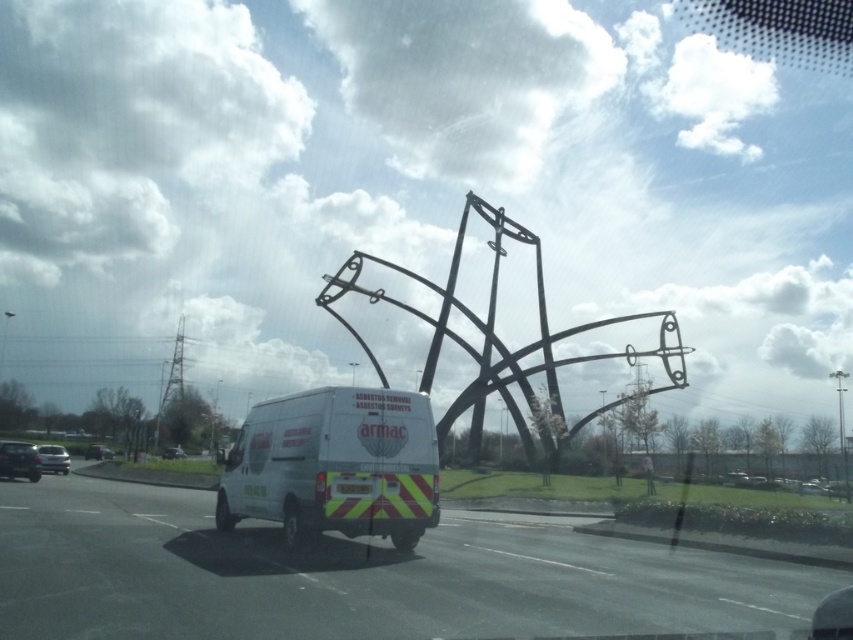
Question: Is white matte van at center thinner than metallic silver van at center?

Choices:
 (A) no
 (B) yes

Answer: (A)

Question: Which point is farther to the camera?

Choices:
 (A) (61, 472)
 (B) (126, 531)

Answer: (A)

Question: Among these points, which one is farthest from the camera?

Choices:
 (A) (288, 426)
 (B) (59, 445)
 (C) (785, 618)

Answer: (B)

Question: Is white van at center smaller than silver metallic car at lower left?

Choices:
 (A) no
 (B) yes

Answer: (B)

Question: Which point is closer to the camera?

Choices:
 (A) (318, 413)
 (B) (166, 452)
 (C) (194, 604)

Answer: (C)

Question: Considering the relative positions of white van at center and silver metallic car at lower left in the image provided, where is white van at center located with respect to silver metallic car at lower left?

Choices:
 (A) above
 (B) below

Answer: (A)